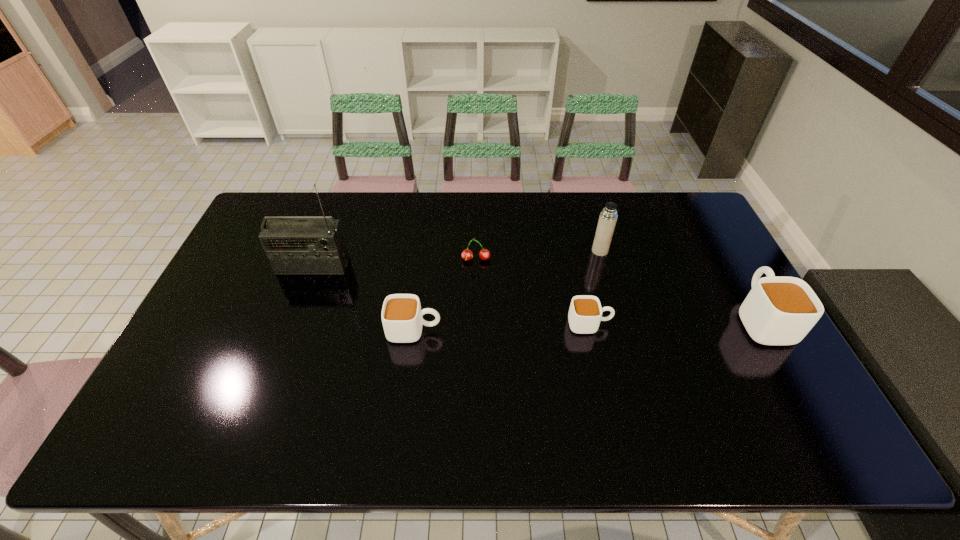
The height and width of the screenshot is (540, 960). What are the coordinates of `vacant space that is in between the fifth shortest object and the cherry` in the screenshot? It's located at (538, 255).

You are a GUI agent. You are given a task and a screenshot of the screen. Output one action in this format:
    pyautogui.click(x=<x>, y=<y>)
    Task: Click on the unoccupied position between the cherry and the leftmost object
    
    Given the screenshot: What is the action you would take?
    pyautogui.click(x=395, y=262)

You are a GUI agent. You are given a task and a screenshot of the screen. Output one action in this format:
    pyautogui.click(x=<x>, y=<y>)
    Task: Click on the second closest object relative to the fourth object from right to left
    This screenshot has width=960, height=540.
    Given the screenshot: What is the action you would take?
    [x=585, y=313]

The image size is (960, 540). I want to click on object that stands as the closest to the fourth object from right to left, so tap(401, 315).

Identify the location of cup identified as the second closest to the cherry. This screenshot has width=960, height=540. (585, 313).

Identify which cup is the second closest to the third object from left to right. Please provide its 2D coordinates. Your answer should be formatted as a tuple, i.e. [(x, y)], where the tuple contains the x and y coordinates of a point satisfying the conditions above.

[(585, 313)]